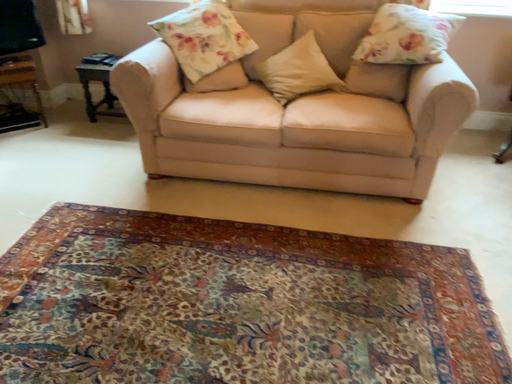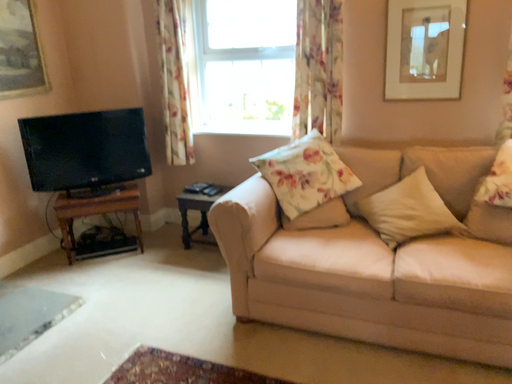
Question: Which way did the camera rotate in the video?

Choices:
 (A) rotated left
 (B) rotated right

Answer: (A)